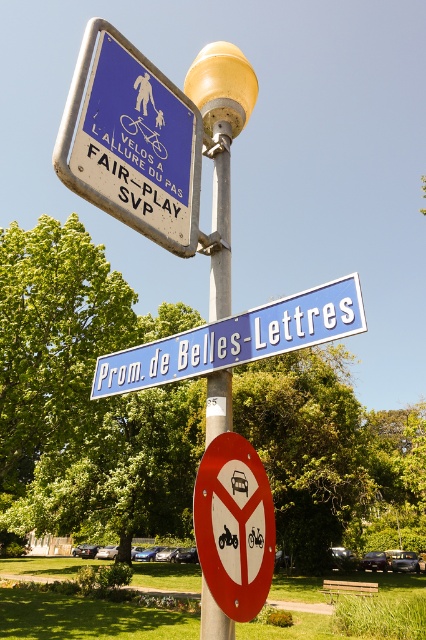
Which is above, yellow plastic lamp post at center or silver metallic pole at center?

yellow plastic lamp post at center

Does yellow plastic lamp post at center have a greater height compared to silver metallic pole at center?

Indeed, yellow plastic lamp post at center has a greater height compared to silver metallic pole at center.

Locate an element on the screen. The image size is (426, 640). yellow plastic lamp post at center is located at coordinates tap(221, 148).

Does blue plastic street sign at center appear on the left side of red plastic sign at lower center?

Correct, you'll find blue plastic street sign at center to the left of red plastic sign at lower center.

Can you confirm if blue plastic street sign at center is wider than red plastic sign at lower center?

Correct, the width of blue plastic street sign at center exceeds that of red plastic sign at lower center.

Measure the distance between blue plastic street sign at center and camera.

The distance of blue plastic street sign at center from camera is 2.69 meters.

This screenshot has height=640, width=426. What are the coordinates of `blue plastic street sign at center` in the screenshot? It's located at (236, 339).

Can you confirm if blue plastic sign at upper left is wider than red plastic sign at lower center?

Yes, blue plastic sign at upper left is wider than red plastic sign at lower center.

Which is in front, point (143, 56) or point (227, 516)?

Point (227, 516) is in front.

Which is behind, point (181, 212) or point (238, 513)?

The point (181, 212) is more distant.

You are a GUI agent. You are given a task and a screenshot of the screen. Output one action in this format:
    pyautogui.click(x=<x>, y=<y>)
    Task: Click on the blue plastic sign at upper left
    
    Given the screenshot: What is the action you would take?
    (132, 141)